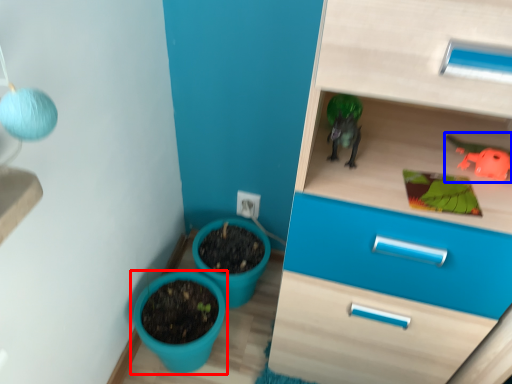
Question: Among these objects, which one is farthest to the camera, flowerpot (highlighted by a red box) or toy (highlighted by a blue box)?

Choices:
 (A) flowerpot
 (B) toy

Answer: (A)